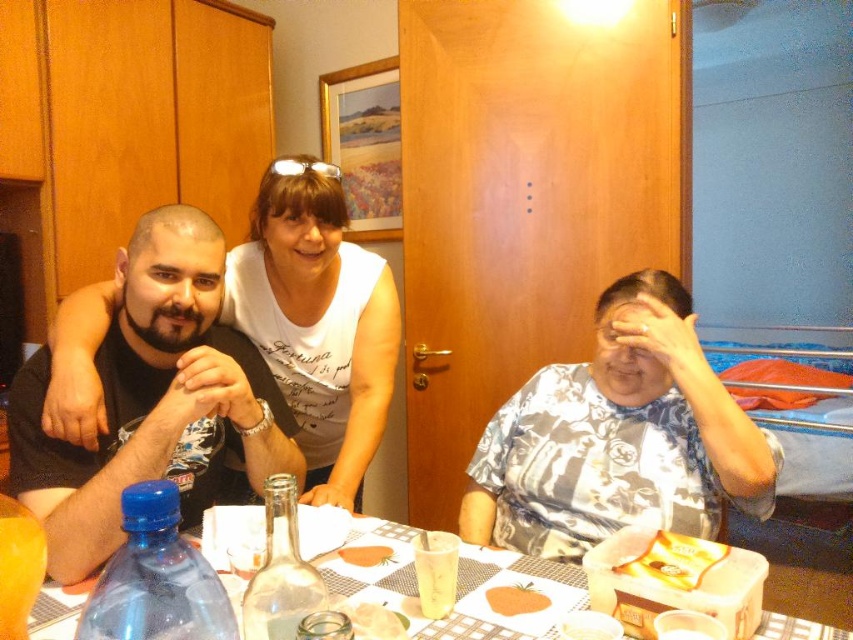
Which of these two, black matte shirt at left or yellow matte snack packet at lower right, stands taller?

black matte shirt at left is taller.

Can you confirm if black matte shirt at left is positioned above yellow matte snack packet at lower right?

Yes.

Identify the location of black matte shirt at left. (148, 392).

Image resolution: width=853 pixels, height=640 pixels. Identify the location of black matte shirt at left. (148, 392).

Between white plastic table at center and translucent glass cup at table center, which one has more height?

translucent glass cup at table center

The height and width of the screenshot is (640, 853). Find the location of `white plastic table at center`. white plastic table at center is located at coordinates (490, 586).

At what (x,y) coordinates should I click in order to perform the action: click on white plastic table at center. Please return your answer as a coordinate pair (x, y). The height and width of the screenshot is (640, 853). Looking at the image, I should click on (490, 586).

At what (x,y) coordinates should I click in order to perform the action: click on white plastic table at center. Please return your answer as a coordinate pair (x, y). This screenshot has width=853, height=640. Looking at the image, I should click on (490, 586).

Consider the image. Between black matte shirt at left and transparent glass bottle at center, which one appears on the right side from the viewer's perspective?

transparent glass bottle at center

Is black matte shirt at left above transparent glass bottle at center?

Indeed, black matte shirt at left is positioned over transparent glass bottle at center.

Find the location of a particular element. black matte shirt at left is located at coordinates (148, 392).